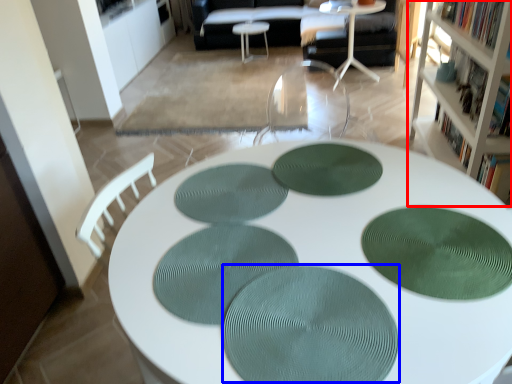
Question: Which object appears closest to the camera in this image, cabinetry (highlighted by a red box) or oval (highlighted by a blue box)?

Choices:
 (A) cabinetry
 (B) oval

Answer: (B)